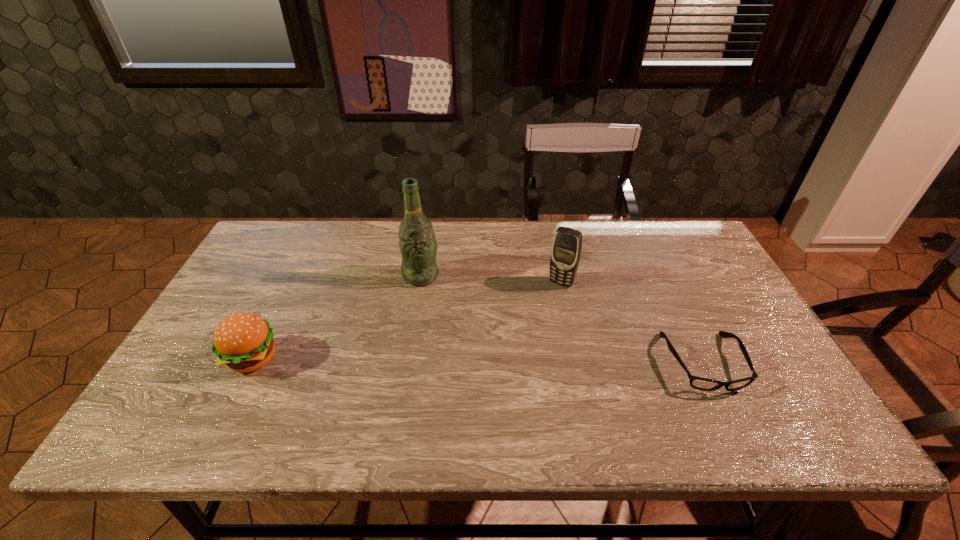
Locate an element on the screen. free region located 0.070m on the surface of the tallest object is located at coordinates (443, 300).

The height and width of the screenshot is (540, 960). I want to click on free space located 0.360m on the surface of the tallest object, so click(503, 369).

This screenshot has height=540, width=960. What are the coordinates of `blank space located on the front face of the third object from left to right` in the screenshot? It's located at (498, 387).

The image size is (960, 540). I want to click on blank space located on the front face of the third object from left to right, so click(x=516, y=357).

Where is `vacant space located 0.380m on the front face of the third object from left to right`? The height and width of the screenshot is (540, 960). vacant space located 0.380m on the front face of the third object from left to right is located at coordinates (498, 387).

Find the location of a particular element. object located in the far edge section of the desktop is located at coordinates (418, 244).

At what (x,y) coordinates should I click in order to perform the action: click on hamburger that is at the near edge. Please return your answer as a coordinate pair (x, y). Looking at the image, I should click on (243, 341).

This screenshot has width=960, height=540. I want to click on spectacles that is positioned at the near edge, so click(699, 383).

Where is `object that is at the left edge`? The height and width of the screenshot is (540, 960). object that is at the left edge is located at coordinates (243, 341).

At what (x,y) coordinates should I click in order to perform the action: click on object situated at the right edge. Please return your answer as a coordinate pair (x, y). The image size is (960, 540). Looking at the image, I should click on (699, 383).